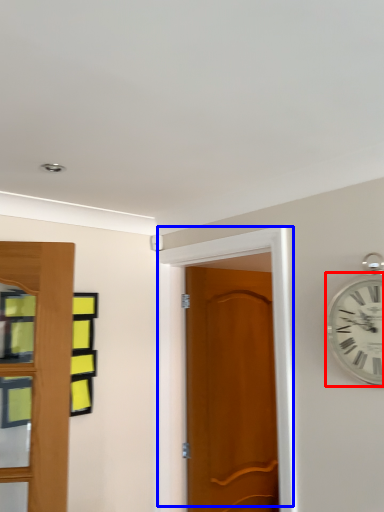
Question: Among these objects, which one is nearest to the camera, wall clock (highlighted by a red box) or door (highlighted by a blue box)?

Choices:
 (A) wall clock
 (B) door

Answer: (A)